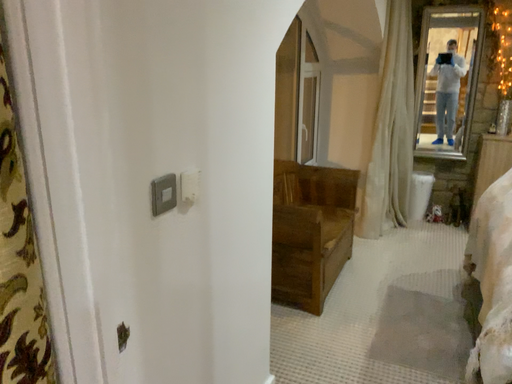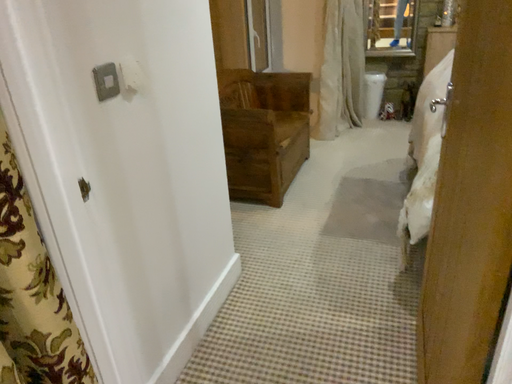
Question: How did the camera likely rotate when shooting the video?

Choices:
 (A) rotated downward
 (B) rotated upward

Answer: (A)